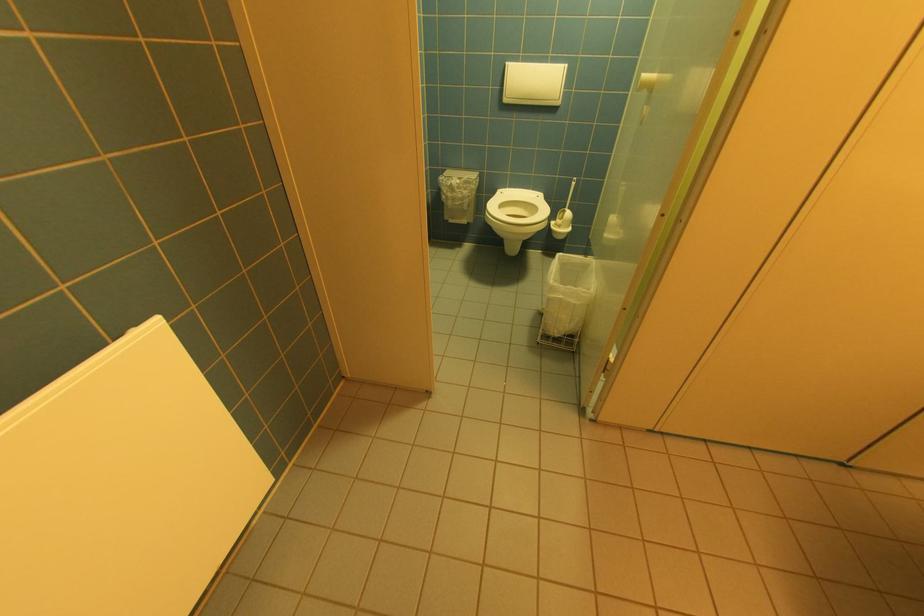
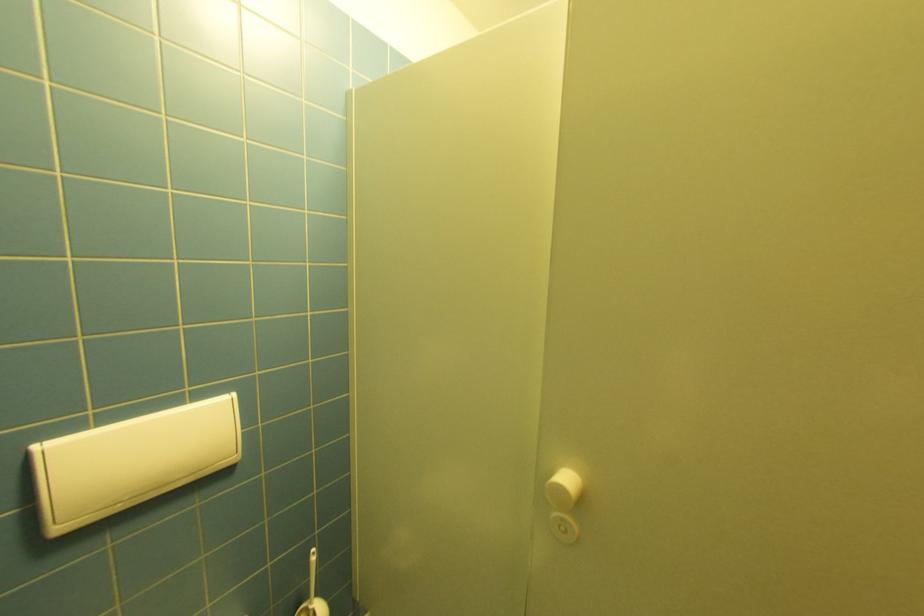
Locate, in the second image, the point that corresponds to point (512, 100) in the first image.

(66, 530)